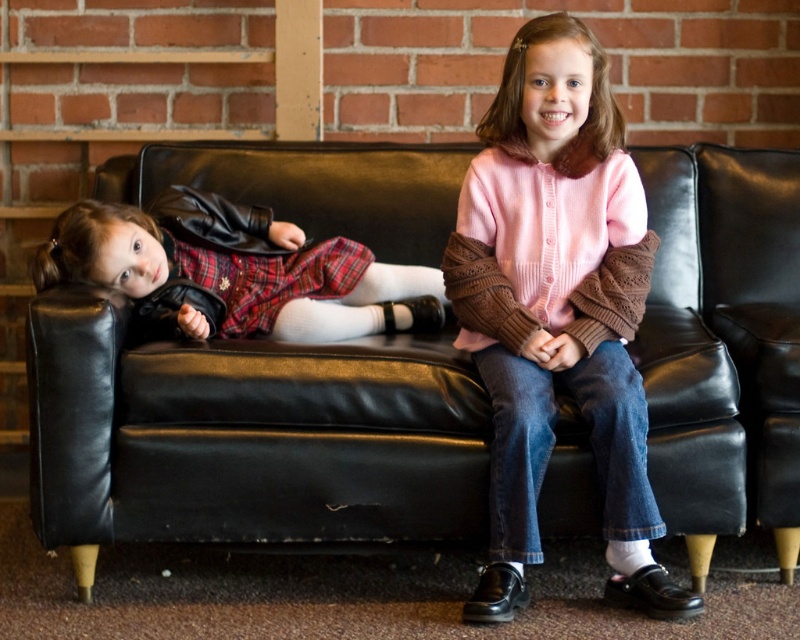
Which of these two, pink knitted sweater at center or black leather couch at right, stands shorter?

Standing shorter between the two is black leather couch at right.

Does point (510, 435) lie in front of point (788, 476)?

Yes, it is in front of point (788, 476).

At what (x,y) coordinates should I click in order to perform the action: click on pink knitted sweater at center. Please return your answer as a coordinate pair (x, y). The height and width of the screenshot is (640, 800). Looking at the image, I should click on (558, 308).

Describe the element at coordinates (248, 435) in the screenshot. The width and height of the screenshot is (800, 640). I see `black leather couch at center` at that location.

Which of these two, black leather couch at center or pink knitted sweater at center, stands shorter?

Standing shorter between the two is black leather couch at center.

Between point (694, 209) and point (632, 454), which one is positioned in front?

Point (632, 454)

In order to click on black leather couch at center in this screenshot , I will do `click(248, 435)`.

Between black leather couch at center and black leather couch at right, which one has more height?

black leather couch at right is taller.

What do you see at coordinates (248, 435) in the screenshot? I see `black leather couch at center` at bounding box center [248, 435].

Locate an element on the screen. black leather couch at center is located at coordinates (248, 435).